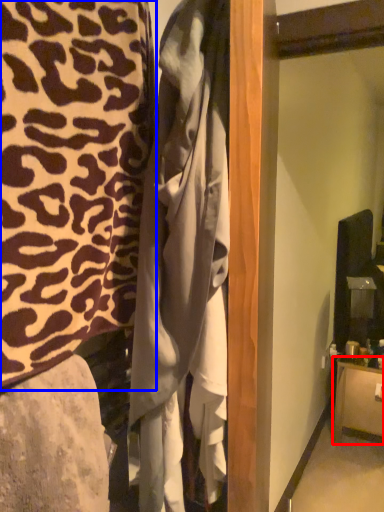
Question: Which object is further to the camera taking this photo, furniture (highlighted by a red box) or furniture (highlighted by a blue box)?

Choices:
 (A) furniture
 (B) furniture

Answer: (A)